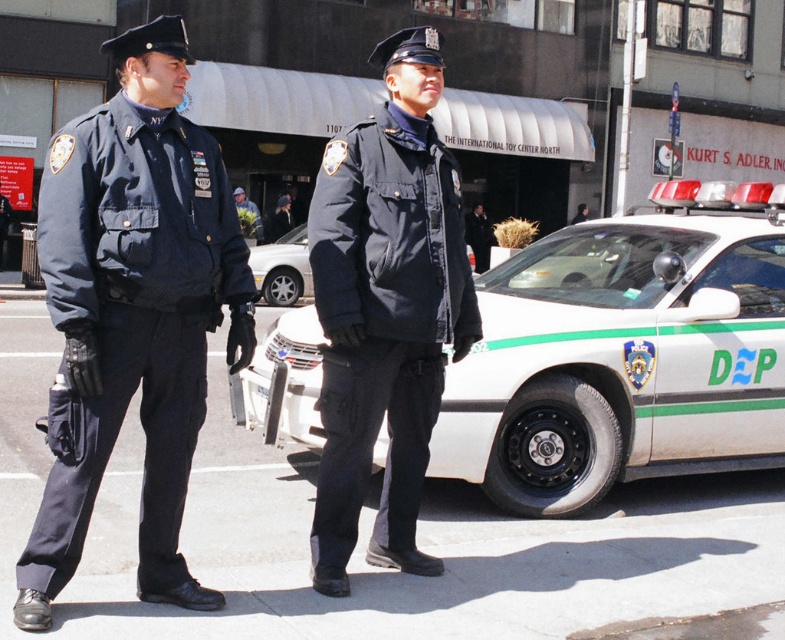
Question: Based on their relative distances, which object is farther from the green leafy bouquet at center?

Choices:
 (A) navy blue fabric uniform at left
 (B) white glossy police car at center
 (C) black matte uniform at center
 (D) navy blue fabric uniform at center

Answer: (A)

Question: Is navy blue fabric uniform at center wider than black matte uniform at center?

Choices:
 (A) yes
 (B) no

Answer: (B)

Question: Which point appears farthest from the camera in this image?

Choices:
 (A) (404, 307)
 (B) (241, 202)
 (C) (81, 422)
 (D) (502, 358)

Answer: (B)

Question: Considering the relative positions of navy blue fabric uniform at left and black matte uniform at center in the image provided, where is navy blue fabric uniform at left located with respect to black matte uniform at center?

Choices:
 (A) left
 (B) right

Answer: (A)

Question: Which object appears farthest from the camera in this image?

Choices:
 (A) navy blue fabric uniform at center
 (B) green leafy bouquet at center
 (C) navy blue fabric uniform at left

Answer: (B)

Question: Does navy blue fabric uniform at center appear on the left side of black matte uniform at center?

Choices:
 (A) yes
 (B) no

Answer: (A)